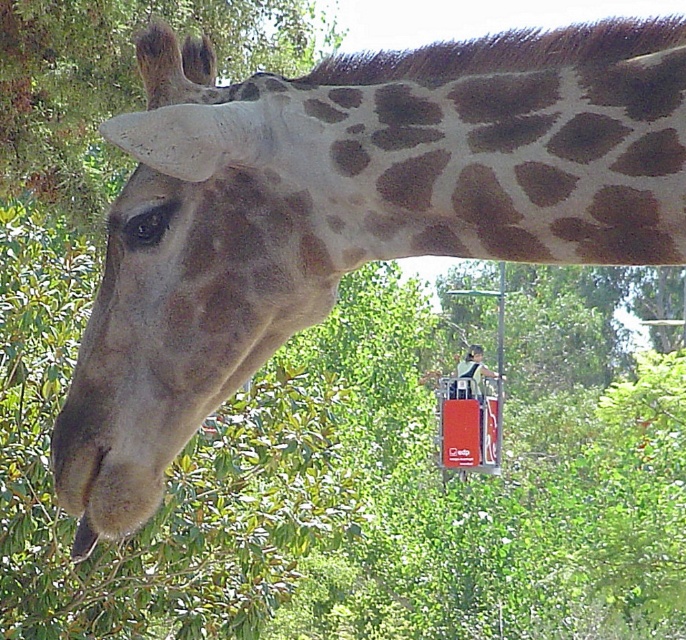
You are a wildlife photographer trying to capture the giraffe in the scene. You notice two brown features at the center of the image. Which one is taller between the brown spotted skin at center and the smooth brown head at center?

The brown spotted skin at center is taller than the smooth brown head at center according to the description.

You are an artist sketching the giraffe and want to ensure the proportions are accurate. Based on the scene, which object is larger in size between the brown spotted skin at center and the smooth brown head at center?

The brown spotted skin at center is bigger than the smooth brown head at center, so the brown spotted skin at center should be drawn larger in your sketch.